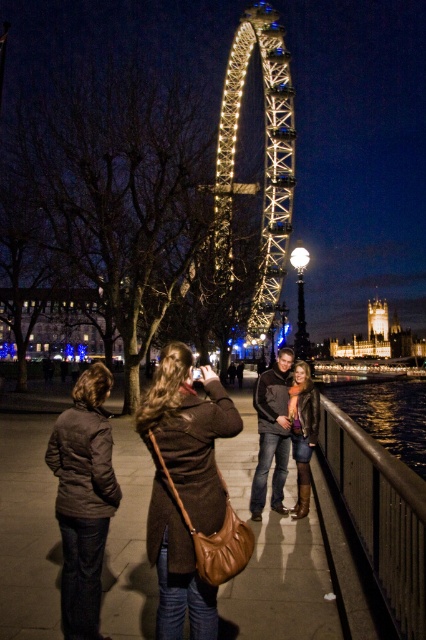
You are a photographer trying to capture a photo of the London Eye Ferris wheel. You notice two people in the foreground wearing jackets. The dark brown quilted jacket at lower left and the leather jacket at center. Which jacket should you focus on to ensure it appears larger in your photo?

The dark brown quilted jacket at lower left has a greater height compared to the leather jacket at center, so focusing on the dark brown quilted jacket at lower left will make it appear larger in the photo.

You are standing at the London Eye at night and want to take a photo of the Ferris wheel. There are two points marked in the scene. Which point, point (169, 548) or point (301, 483), is closer to you?

Point (169, 548) is closer to you than point (301, 483).

You are a photographer standing at the London Eye area. You want to take a photo of the Ferris wheel with both the brown leather purse at center and the leather jacket at center in the frame. Since the purse and jacket are both at the center, which one will appear bigger in the photo?

The brown leather purse at center has a larger size compared to the leather jacket at center, so it will appear bigger in the photo.